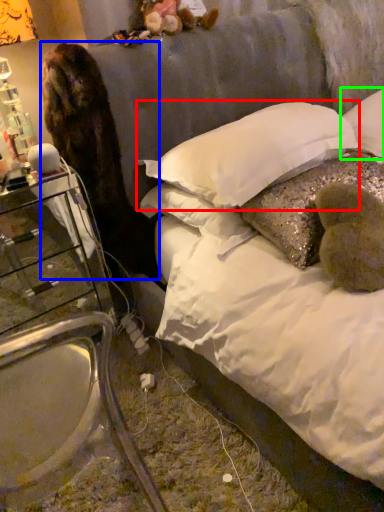
Question: Considering the real-world distances, which object is closest to pillow (highlighted by a red box)? animal (highlighted by a blue box) or pillow (highlighted by a green box).

Choices:
 (A) animal
 (B) pillow

Answer: (A)